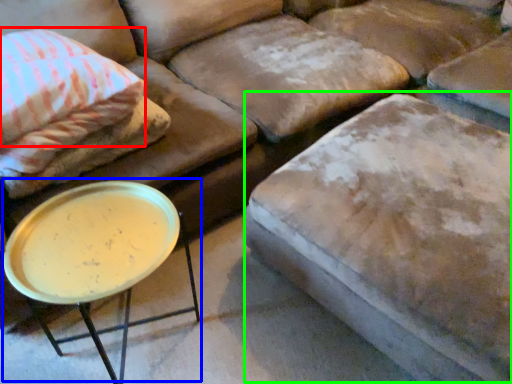
Question: Which object is positioned closest to pillow (highlighted by a red box)? Select from round table (highlighted by a blue box) and swivel chair (highlighted by a green box).

Choices:
 (A) round table
 (B) swivel chair

Answer: (A)